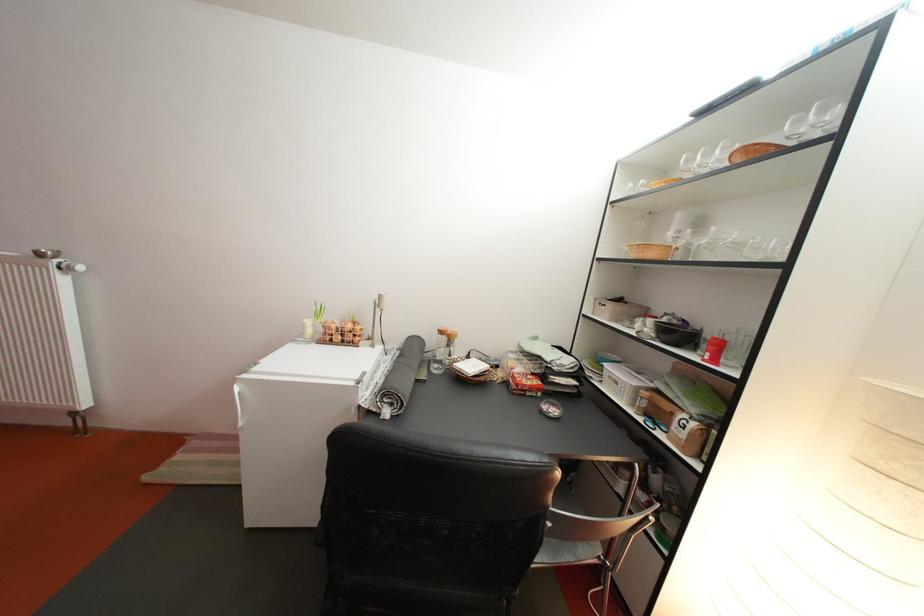
Describe the element at coordinates (67, 264) in the screenshot. I see `the white radiator knob` at that location.